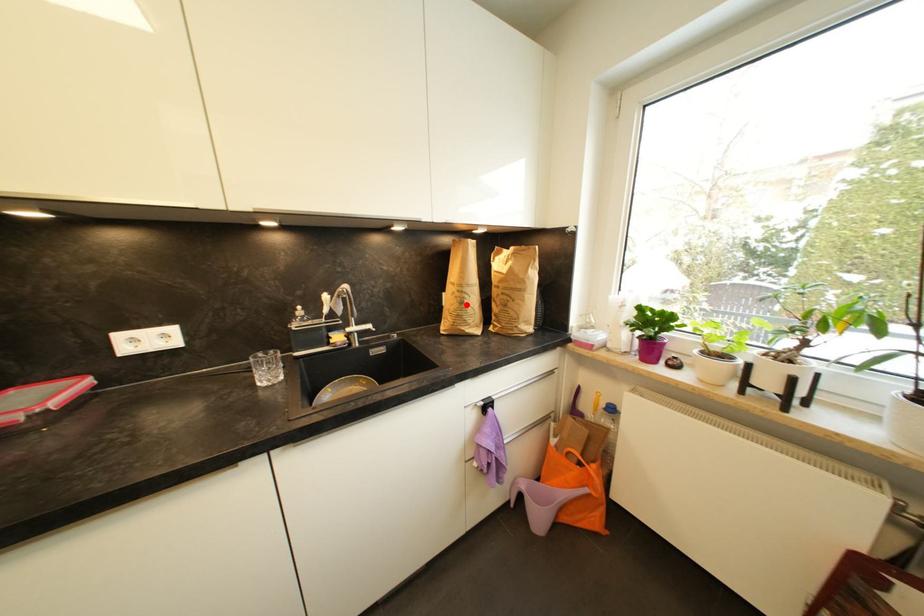
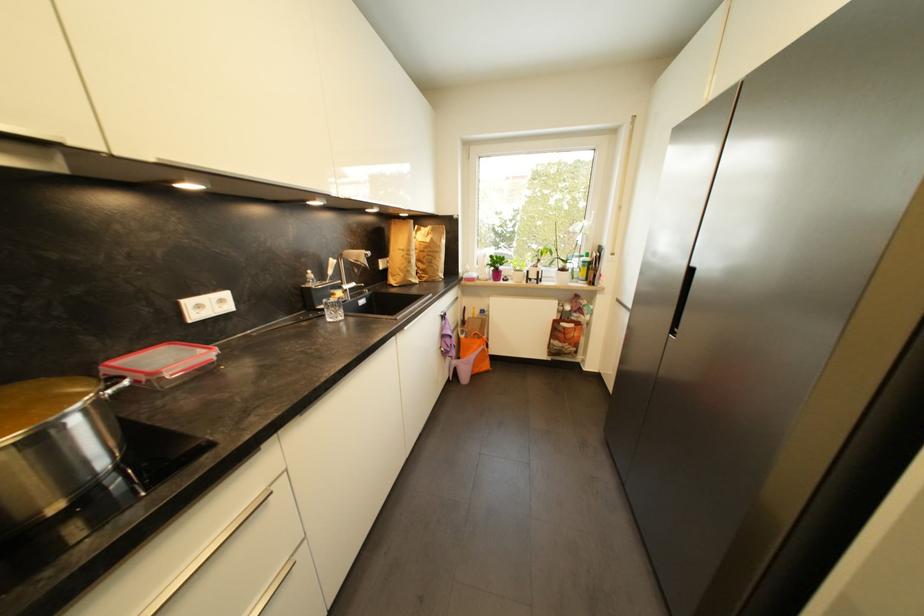
Find the pixel in the second image that matches the highlighted location in the first image.

(415, 264)